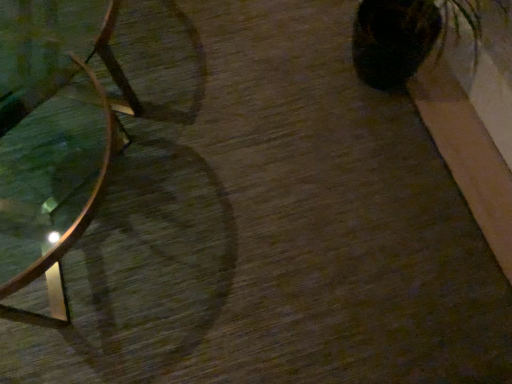
This screenshot has height=384, width=512. In order to click on metallic glass table at left in this screenshot , I will do `click(53, 139)`.

The width and height of the screenshot is (512, 384). What do you see at coordinates (53, 139) in the screenshot?
I see `metallic glass table at left` at bounding box center [53, 139].

Image resolution: width=512 pixels, height=384 pixels. What are the coordinates of `metallic glass table at left` in the screenshot? It's located at (53, 139).